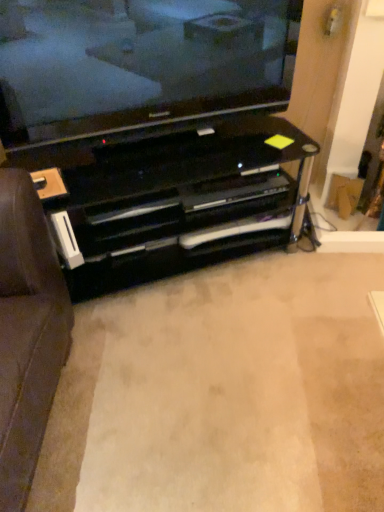
What do you see at coordinates (174, 200) in the screenshot? This screenshot has height=512, width=384. I see `black glossy entertainment center at center` at bounding box center [174, 200].

Where is `black glossy entertainment center at center`? black glossy entertainment center at center is located at coordinates (174, 200).

Identify the location of black glass television at upper center. (136, 65).

Locate an element on the screen. black glossy entertainment center at center is located at coordinates (174, 200).

Is black glossy tv stand at center with black glossy entertainment center at center?

No.

Between point (63, 496) and point (245, 233), which one is positioned in front?

The point (63, 496) is more forward.

Relative to black glossy entertainment center at center, is black glossy tv stand at center in front or behind?

Clearly, black glossy tv stand at center is in front of black glossy entertainment center at center.

Can you tell me how much black glossy tv stand at center and black glossy entertainment center at center differ in facing direction?

black glossy tv stand at center and black glossy entertainment center at center are facing 69.6 degrees away from each other.

From a real-world perspective, which is physically above, black glossy entertainment center at center or black glossy tv stand at center?

black glossy entertainment center at center is physically above.

Who is taller, black glossy entertainment center at center or black glossy tv stand at center?

black glossy entertainment center at center is taller.

Between black glossy entertainment center at center and black glossy tv stand at center, which one has larger width?

black glossy tv stand at center is wider.

Looking at this image, measure the distance from black glossy entertainment center at center to black glossy tv stand at center.

black glossy entertainment center at center is 15.05 inches from black glossy tv stand at center.

Identify the location of television above the black glossy entertainment center at center (from a real-world perspective). [136, 65].

Is black glossy entertainment center at center oriented towards black glass television at upper center?

No, black glossy entertainment center at center is not aimed at black glass television at upper center.

Does black glossy entertainment center at center appear on the right side of black glass television at upper center?

Incorrect, black glossy entertainment center at center is not on the right side of black glass television at upper center.

Which object is closer to the camera taking this photo, black glass television at upper center or black glossy entertainment center at center?

black glass television at upper center is closer to the camera.

Does black glass television at upper center appear on the right side of black glossy entertainment center at center?

Correct, you'll find black glass television at upper center to the right of black glossy entertainment center at center.

Consider the image. How different are the orientations of black glass television at upper center and black glossy entertainment center at center in degrees?

1.65 degrees.

Is black glass television at upper center directly adjacent to black glossy entertainment center at center?

No, black glass television at upper center is not next to black glossy entertainment center at center.

From the image's perspective, which is above, black glass television at upper center or black glossy tv stand at center?

black glass television at upper center, from the image's perspective.

Can you confirm if black glass television at upper center is taller than black glossy tv stand at center?

Correct, black glass television at upper center is much taller as black glossy tv stand at center.

Looking at this image, is black glass television at upper center wider than black glossy tv stand at center?

No, black glass television at upper center is not wider than black glossy tv stand at center.

Are black glass television at upper center and black glossy tv stand at center beside each other?

They are not placed beside each other.

Considering the relative positions of black glossy tv stand at center and black glass television at upper center in the image provided, is black glossy tv stand at center to the right of black glass television at upper center from the viewer's perspective?

Yes.

In the scene shown: From a real-world perspective, relative to black glass television at upper center, is black glossy tv stand at center vertically above or below?

From a real-world perspective, black glossy tv stand at center is physically below black glass television at upper center.

From the picture: Are black glossy tv stand at center and black glass television at upper center far apart?

No, there isn't a large distance between black glossy tv stand at center and black glass television at upper center.

From the image's perspective, is black glossy tv stand at center positioned above or below black glass television at upper center?

black glossy tv stand at center is situated lower than black glass television at upper center in the image.

Locate an element on the screen. The height and width of the screenshot is (512, 384). plain located in front of the black glossy entertainment center at center is located at coordinates (224, 393).

Identify the location of entertainment center above the black glossy tv stand at center (from the image's perspective). (174, 200).

When comparing their distances from black glass television at upper center, does black glossy tv stand at center or black glossy entertainment center at center seem further?

black glossy tv stand at center.

Looking at the image, which one is located further to black glossy tv stand at center, black glossy entertainment center at center or black glass television at upper center?

black glass television at upper center.

When comparing their distances from black glossy entertainment center at center, does black glossy tv stand at center or black glass television at upper center seem closer?

black glass television at upper center lies closer to black glossy entertainment center at center than the other object.

Considering their positions, is black glass television at upper center positioned closer to black glossy entertainment center at center than black glossy tv stand at center?

black glass television at upper center.

Estimate the real-world distances between objects in this image. Which object is further from black glossy tv stand at center, black glass television at upper center or black glossy entertainment center at center?

black glass television at upper center is positioned further to the anchor black glossy tv stand at center.

Estimate the real-world distances between objects in this image. Which object is closer to black glass television at upper center, black glossy entertainment center at center or black glossy tv stand at center?

The object closer to black glass television at upper center is black glossy entertainment center at center.

At what (x,y) coordinates should I click in order to perform the action: click on entertainment center between black glass television at upper center and black glossy tv stand at center in the up-down direction. Please return your answer as a coordinate pair (x, y). Image resolution: width=384 pixels, height=512 pixels. Looking at the image, I should click on (174, 200).